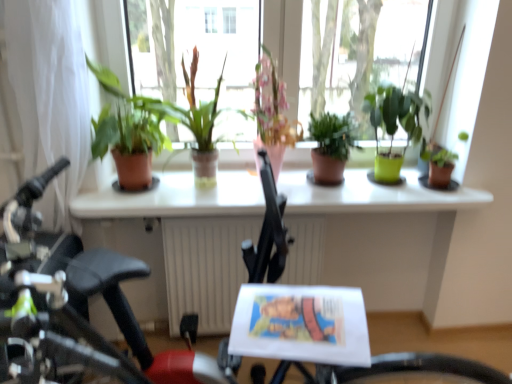
Identify the location of free spot below green matte plant at center, which appears as the 4th houseplant when viewed from the left (from a real-world perspective). The height and width of the screenshot is (384, 512). (333, 185).